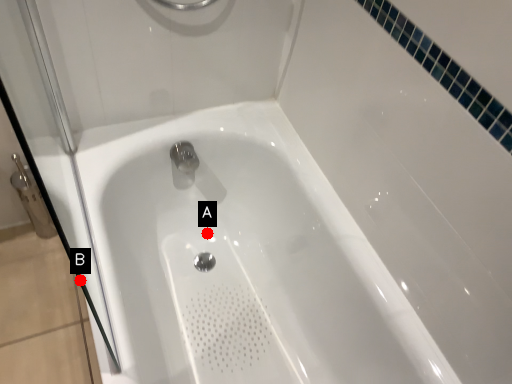
Question: Two points are circled on the image, labeled by A and B beside each circle. Among these points, which one is nearest to the camera?

Choices:
 (A) A is closer
 (B) B is closer

Answer: (B)